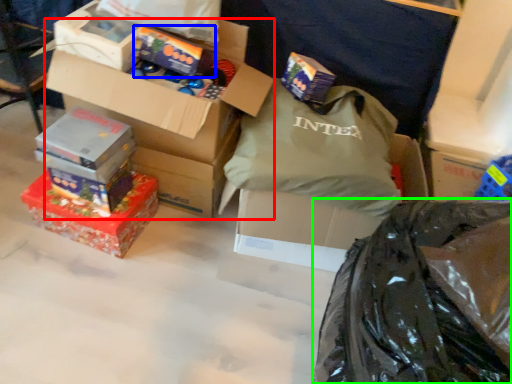
Question: Estimate the real-world distances between objects in this image. Which object is closer to box (highlighted by a red box), box (highlighted by a blue box) or plastic bag (highlighted by a green box)?

Choices:
 (A) box
 (B) plastic bag

Answer: (A)